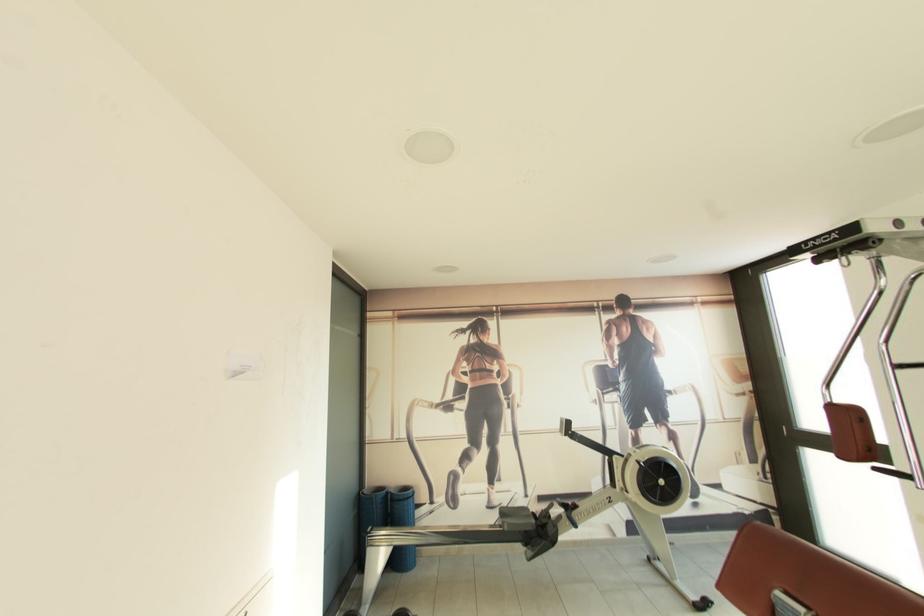
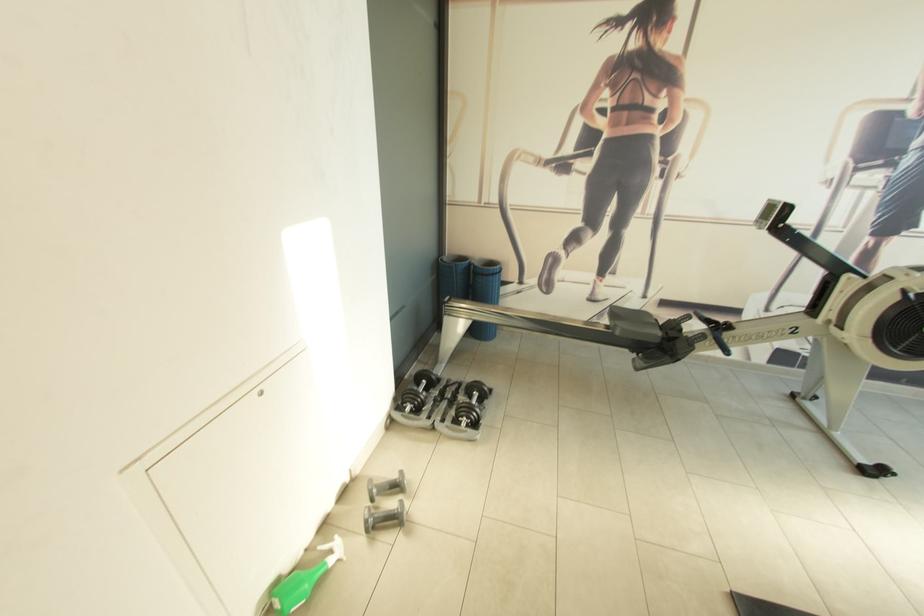
Locate, in the second image, the point that corresponds to point (511, 531) in the first image.

(622, 334)